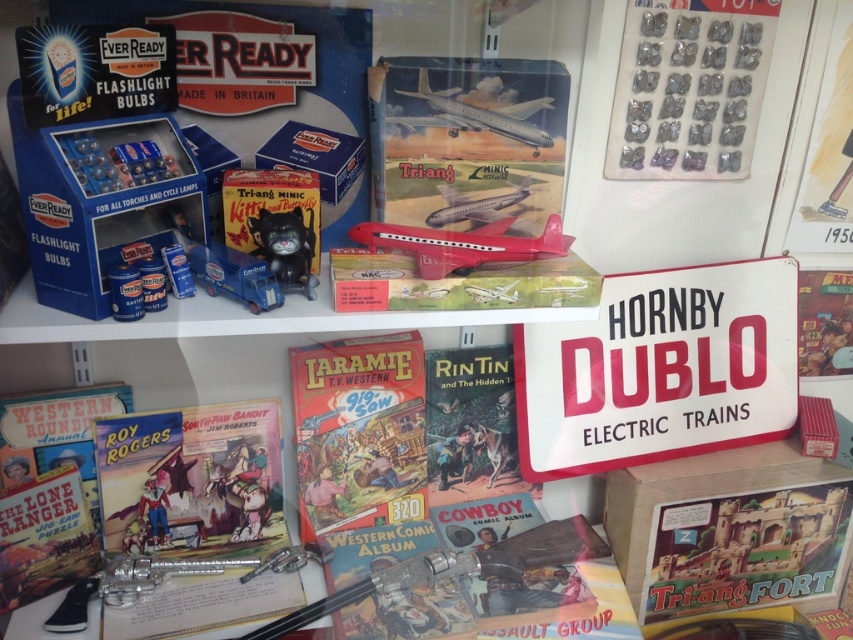
You are a collector organizing a vintage toy exhibit. You have a metallic airplane at upper center and a metallic silver airplane at center in your display. Which airplane is placed higher in the arrangement?

The metallic airplane at upper center is placed higher than the metallic silver airplane at center because it is positioned over it.

You are a collector standing 3 feet away from the display. Can you comfortably reach the metallic airplane at upper center without moving closer?

The metallic airplane at upper center is 39.16 inches away from the viewer. Since 3 feet equals 36 inches, you are 3.16 inches too far to comfortably reach it without moving closer.